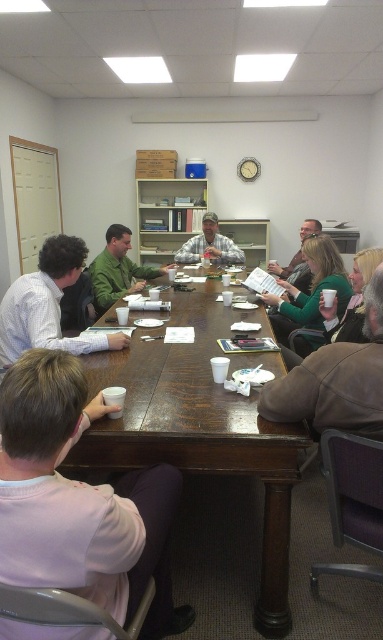
Does white shirt at left appear on the left side of green matte shirt at center?

No, white shirt at left is not to the left of green matte shirt at center.

Which is behind, point (50, 291) or point (99, 316)?

Positioned behind is point (99, 316).

Identify the location of white shirt at left. This screenshot has width=383, height=640. (47, 305).

Between white shirt at left and matte gray shirt at upper center, which one appears on the right side from the viewer's perspective?

From the viewer's perspective, matte gray shirt at upper center appears more on the right side.

Does point (58, 300) lie in front of point (283, 273)?

That is True.

Does point (24, 292) come closer to viewer compared to point (306, 228)?

Yes.

Image resolution: width=383 pixels, height=640 pixels. Find the location of `white shirt at left`. white shirt at left is located at coordinates 47,305.

Which of these two, green matte shirt at center or matte gray shirt at upper center, stands shorter?

Standing shorter between the two is matte gray shirt at upper center.

Can you confirm if green matte shirt at center is shorter than matte gray shirt at upper center?

No.

Who is more forward, (101,296) or (296,256)?

Point (101,296) is in front.

The height and width of the screenshot is (640, 383). Identify the location of green matte shirt at center. (117, 269).